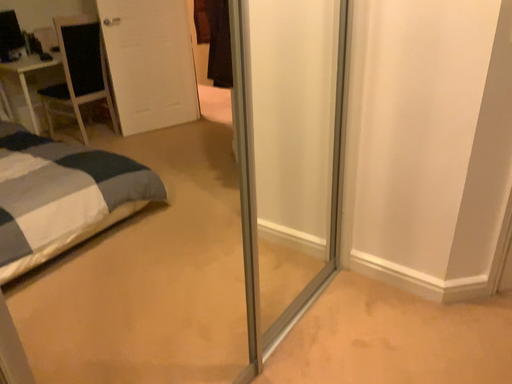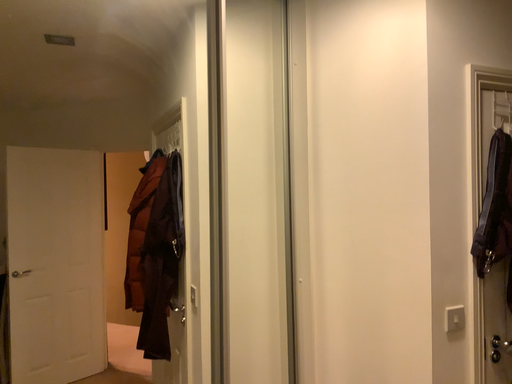
Question: Which way did the camera rotate in the video?

Choices:
 (A) rotated right
 (B) rotated left

Answer: (A)